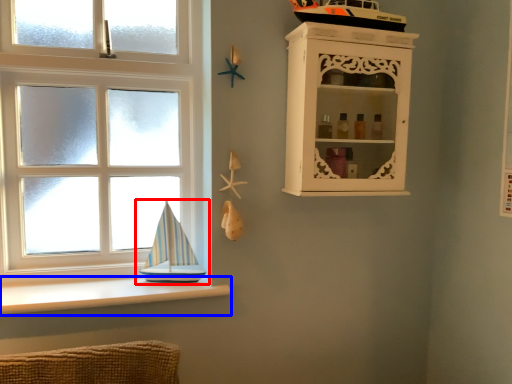
Question: Which object is closer to the camera taking this photo, boat (highlighted by a red box) or ledge (highlighted by a blue box)?

Choices:
 (A) boat
 (B) ledge

Answer: (B)